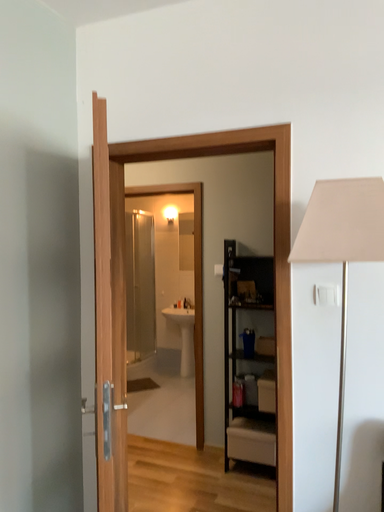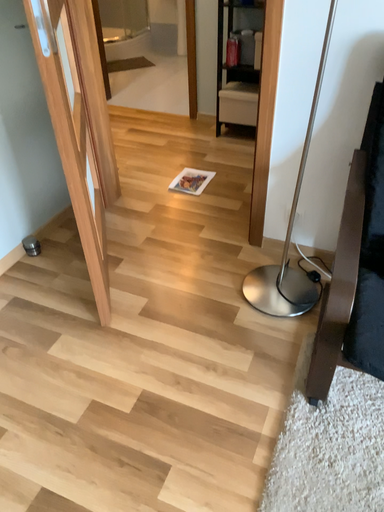
Question: How did the camera likely rotate when shooting the video?

Choices:
 (A) rotated downward
 (B) rotated upward

Answer: (A)